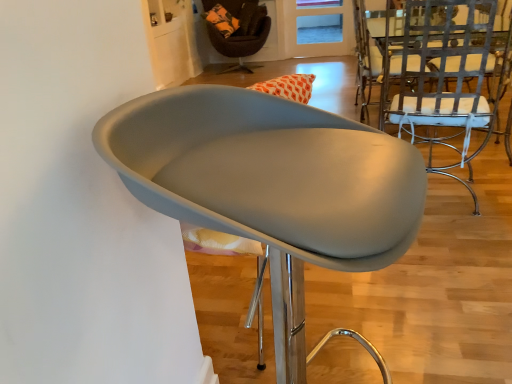
Question: Do you think matte gray chair at center, positioned as the third chair in top-to-bottom order, is within velvet brown armchair at upper center, placed as the first chair when sorted from back to front, or outside of it?

Choices:
 (A) inside
 (B) outside

Answer: (B)

Question: Is matte gray chair at center, the first chair positioned from the front, in front of or behind velvet brown armchair at upper center, marked as the 3th chair in a bottom-to-top arrangement, in the image?

Choices:
 (A) front
 (B) behind

Answer: (A)

Question: Based on their relative distances, which object is nearer to the metallic silver chair at right, the second chair viewed from the top?

Choices:
 (A) matte gray chair at center, the third chair viewed from the back
 (B) velvet brown armchair at upper center, which ranks as the 3th chair in front-to-back order
 (C) translucent orange glass door at upper center

Answer: (A)

Question: Based on their relative distances, which object is farther from the matte gray chair at center, the first chair positioned from the front?

Choices:
 (A) velvet brown armchair at upper center, positioned as the 1th chair in top-to-bottom order
 (B) metallic silver chair at right, which ranks as the 2th chair in back-to-front order
 (C) translucent orange glass door at upper center

Answer: (C)